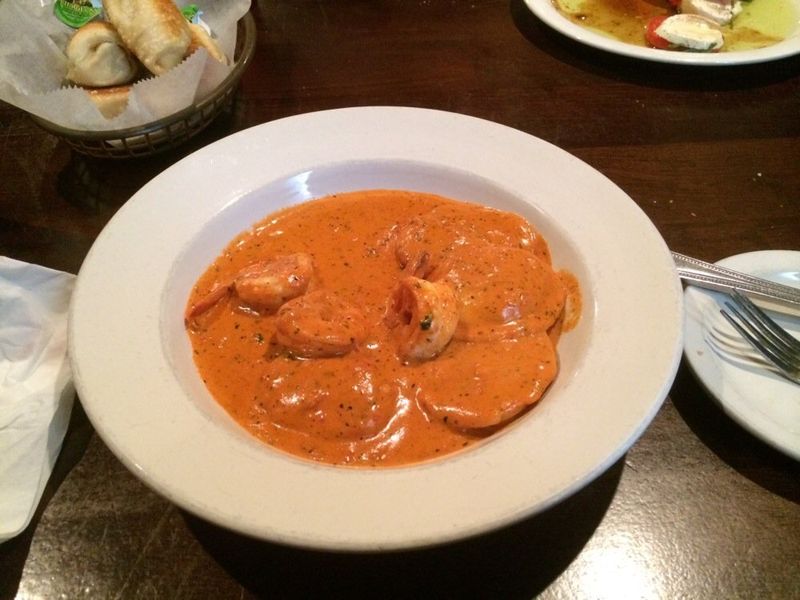
This screenshot has height=600, width=800. I want to click on basket, so click(129, 151).